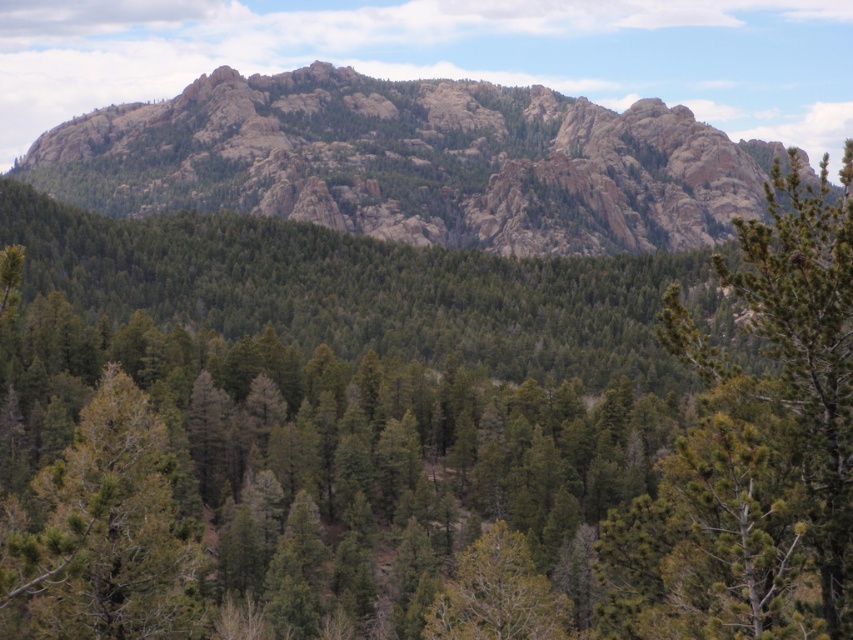
You are a hiker planning to take a photo of the rugged granite mountain at upper center and the green matte tree at lower left. Which object should you focus on first if you want to capture both in a single frame without moving the camera?

You should focus on the rugged granite mountain at upper center first because it is positioned over the green matte tree at lower left, meaning it is closer to the camera. By focusing on the closer object first, the depth of field may naturally include the background object as well.

You are standing in the forest and want to walk towards the green matte tree at center. Which direction should you move relative to the green matte tree at lower left?

Since the green matte tree at lower left is closer to the viewer than the green matte tree at center, you should move away from the green matte tree at lower left to reach the green matte tree at center.